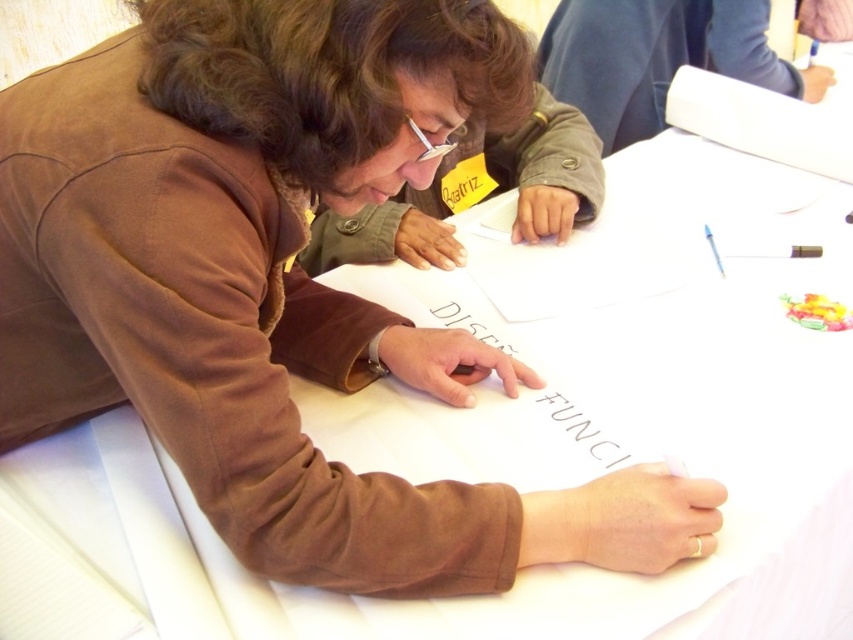
Question: Which point appears farthest from the camera in this image?

Choices:
 (A) (730, 19)
 (B) (509, 403)

Answer: (A)

Question: Which point is farther to the camera?

Choices:
 (A) blue fabric at upper center
 (B) white paper at center

Answer: (A)

Question: Which point is closer to the camera taking this photo?

Choices:
 (A) (556, 93)
 (B) (508, 404)

Answer: (B)

Question: Can you confirm if blue fabric at upper center is wider than white paper at center?

Choices:
 (A) yes
 (B) no

Answer: (A)

Question: From the image, what is the correct spatial relationship of blue fabric at upper center in relation to white paper at center?

Choices:
 (A) left
 (B) right

Answer: (B)

Question: Can you confirm if blue fabric at upper center is positioned to the left of white paper at center?

Choices:
 (A) yes
 (B) no

Answer: (B)